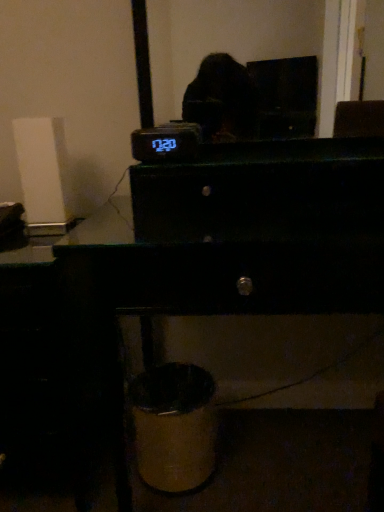
In order to face black glossy desk at center, should I rotate leftwards or rightwards?

Rotate your view right by about 9.798°.

What do you see at coordinates (207, 325) in the screenshot?
I see `black glossy desk at center` at bounding box center [207, 325].

Where is `black glossy desk at center`? This screenshot has height=512, width=384. black glossy desk at center is located at coordinates [207, 325].

Where is `black glossy desk at center`? Image resolution: width=384 pixels, height=512 pixels. black glossy desk at center is located at coordinates (207, 325).